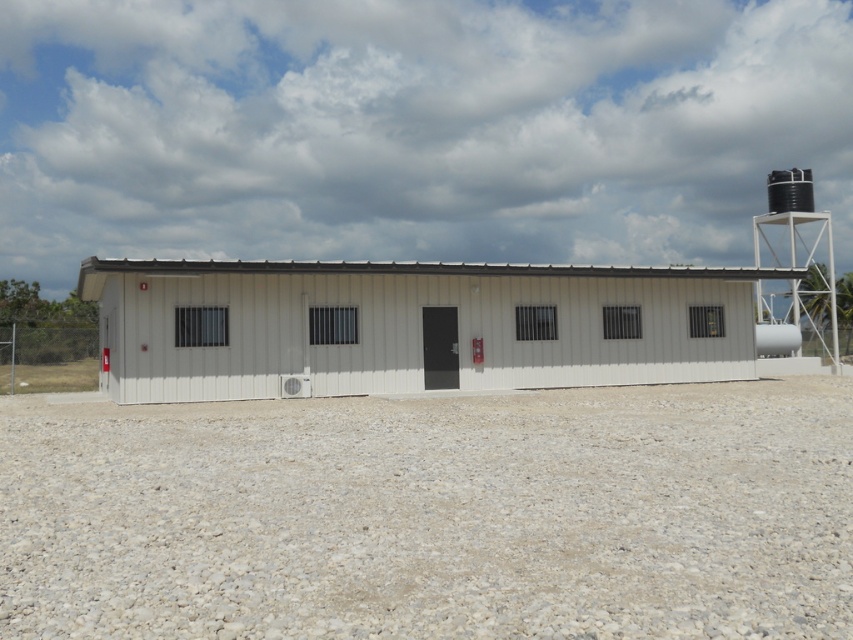
Does gray gravel at center have a lesser width compared to white corrugated metal shed at center?

Yes.

Is point (183, 449) positioned after point (218, 326)?

No, (183, 449) is in front of (218, 326).

What do you see at coordinates (433, 515) in the screenshot? I see `gray gravel at center` at bounding box center [433, 515].

At what (x,y) coordinates should I click in order to perform the action: click on gray gravel at center. Please return your answer as a coordinate pair (x, y). The width and height of the screenshot is (853, 640). Looking at the image, I should click on [433, 515].

Between white corrugated metal shed at center and black matte water tower at upper right, which one is positioned higher?

black matte water tower at upper right

Can you confirm if white corrugated metal shed at center is bigger than black matte water tower at upper right?

No, white corrugated metal shed at center is not bigger than black matte water tower at upper right.

Who is more forward, (531, 355) or (769, 180)?

Point (531, 355)

The height and width of the screenshot is (640, 853). Identify the location of white corrugated metal shed at center. (410, 326).

Describe the element at coordinates (433, 515) in the screenshot. I see `gray gravel at center` at that location.

Does gray gravel at center have a smaller size compared to black matte water tower at upper right?

Yes, gray gravel at center is smaller than black matte water tower at upper right.

Describe the element at coordinates (433, 515) in the screenshot. I see `gray gravel at center` at that location.

The width and height of the screenshot is (853, 640). I want to click on gray gravel at center, so click(433, 515).